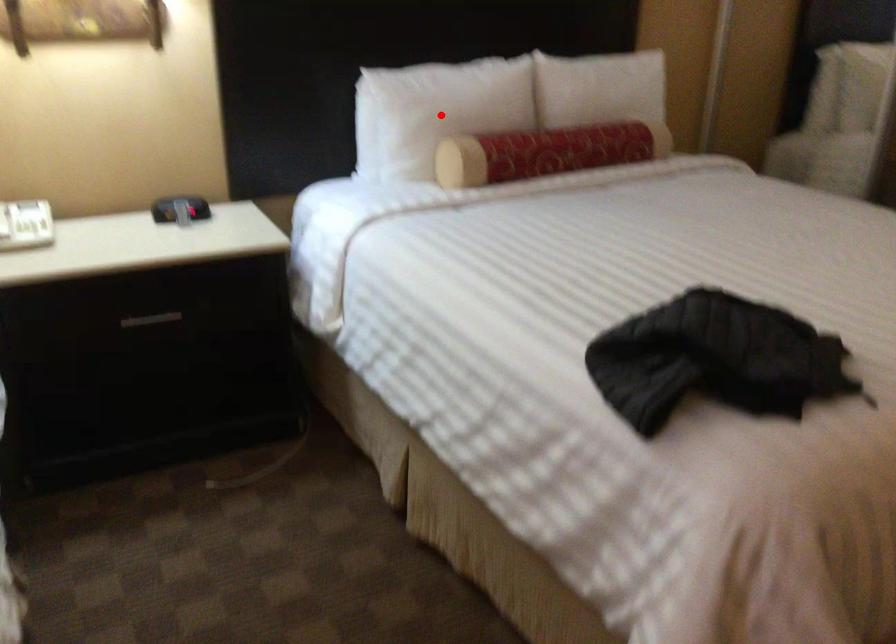
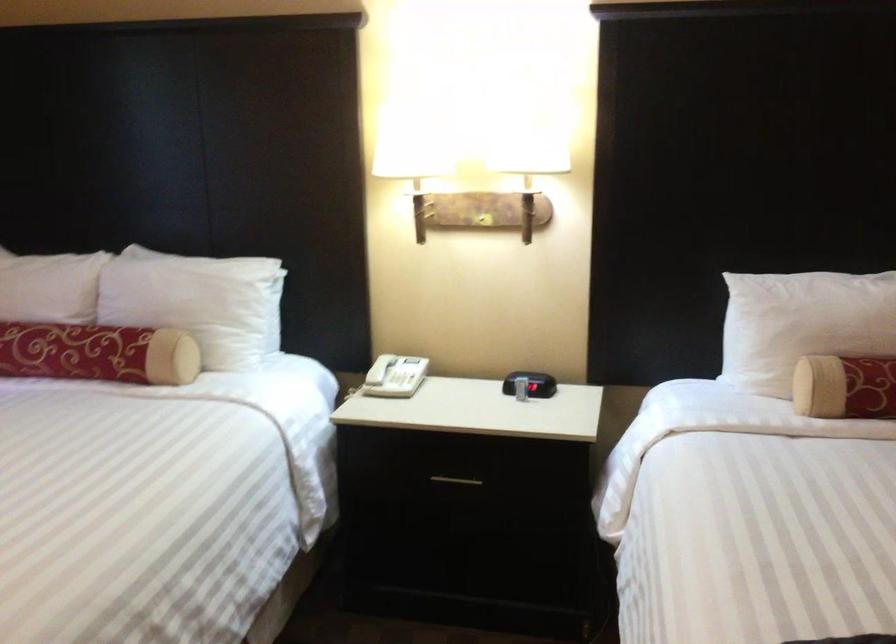
Question: A red point is marked in image1. In image2, is the corresponding 3D point closer to the camera or farther? Reply with the corresponding letter.

Choices:
 (A) The corresponding 3D point is closer.
 (B) The corresponding 3D point is farther.

Answer: (A)